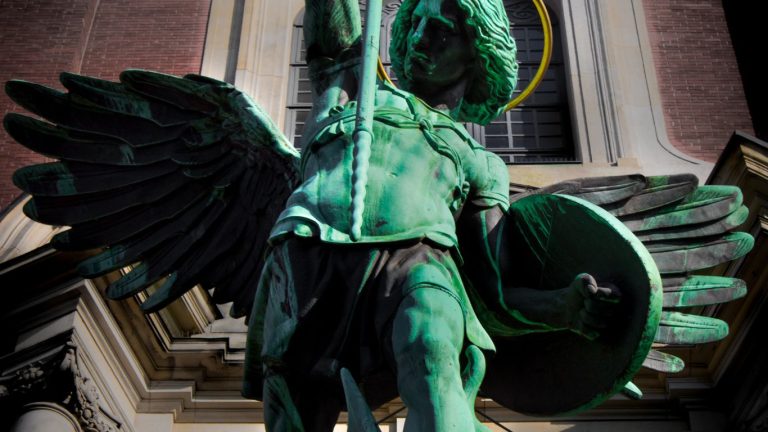
Image resolution: width=768 pixels, height=432 pixels. What are the coordinates of `window` in the screenshot? It's located at [505, 138].